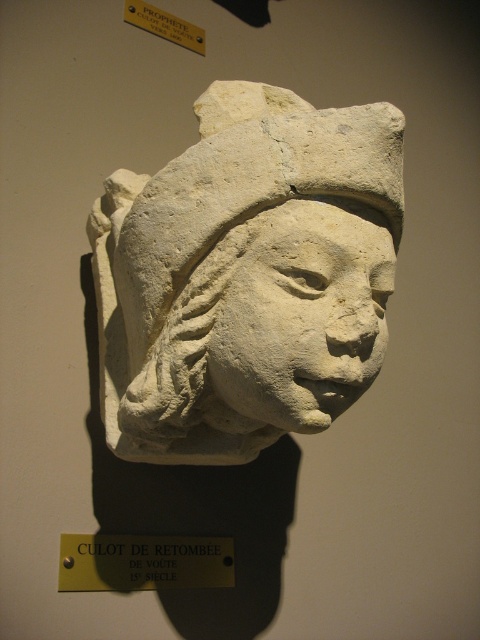
Question: Is white stone head at center in front of white stone face at center?

Choices:
 (A) no
 (B) yes

Answer: (A)

Question: Which object is positioned closest to the gold/yellow metal plaque at center?

Choices:
 (A) white stone face at center
 (B) white stone head at center

Answer: (B)

Question: Considering the real-world distances, which object is closest to the white stone head at center?

Choices:
 (A) gold/yellow metal plaque at center
 (B) white stone face at center

Answer: (B)

Question: Does white stone head at center have a smaller size compared to white stone face at center?

Choices:
 (A) no
 (B) yes

Answer: (A)

Question: Can you confirm if white stone head at center is smaller than gold/yellow metal plaque at center?

Choices:
 (A) no
 (B) yes

Answer: (A)

Question: Among these objects, which one is nearest to the camera?

Choices:
 (A) white stone head at center
 (B) gold/yellow metal plaque at center
 (C) white stone face at center

Answer: (C)